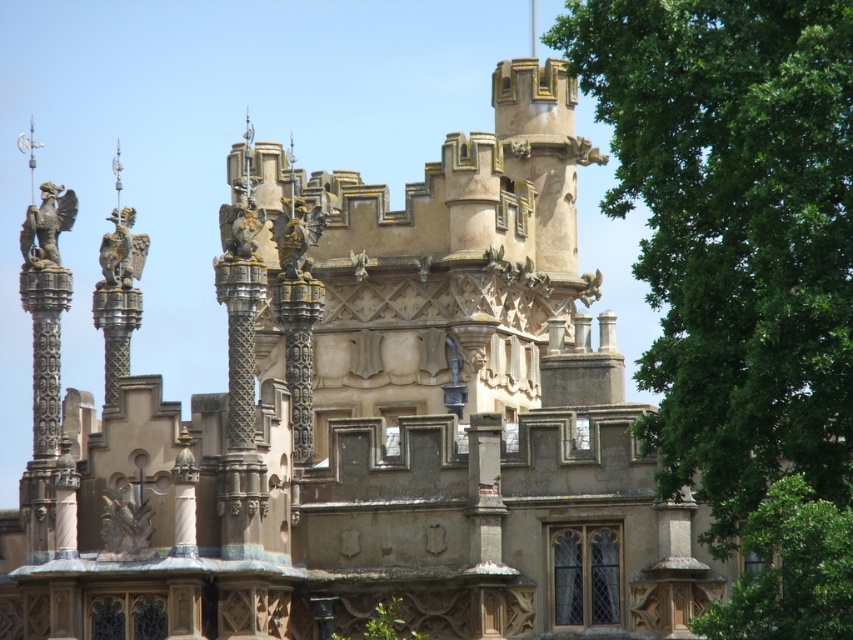
Can you confirm if green leafy tree at lower right is taller than polished bronze eagle at left?

Yes, green leafy tree at lower right is taller than polished bronze eagle at left.

Is point (828, 540) less distant than point (109, 266)?

Yes, point (828, 540) is in front of point (109, 266).

Is point (693, 625) in front of point (125, 253)?

Yes, it is in front of point (125, 253).

Identify the location of green leafy tree at lower right. This screenshot has width=853, height=640. (788, 570).

Who is positioned more to the right, green leafy tree at lower right or polished bronze eagle at upper left?

From the viewer's perspective, green leafy tree at lower right appears more on the right side.

Who is shorter, green leafy tree at lower right or polished bronze eagle at upper left?

Standing shorter between the two is polished bronze eagle at upper left.

Between point (792, 568) and point (57, 188), which one is positioned in front?

Point (792, 568) is in front.

The height and width of the screenshot is (640, 853). I want to click on green leafy tree at lower right, so click(x=788, y=570).

Is polished bronze eagle at left further to camera compared to bronze statue at upper right?

No, polished bronze eagle at left is in front of bronze statue at upper right.

Which is in front, point (112, 285) or point (590, 273)?

Positioned in front is point (112, 285).

Locate an element on the screen. This screenshot has height=640, width=853. polished bronze eagle at left is located at coordinates (120, 252).